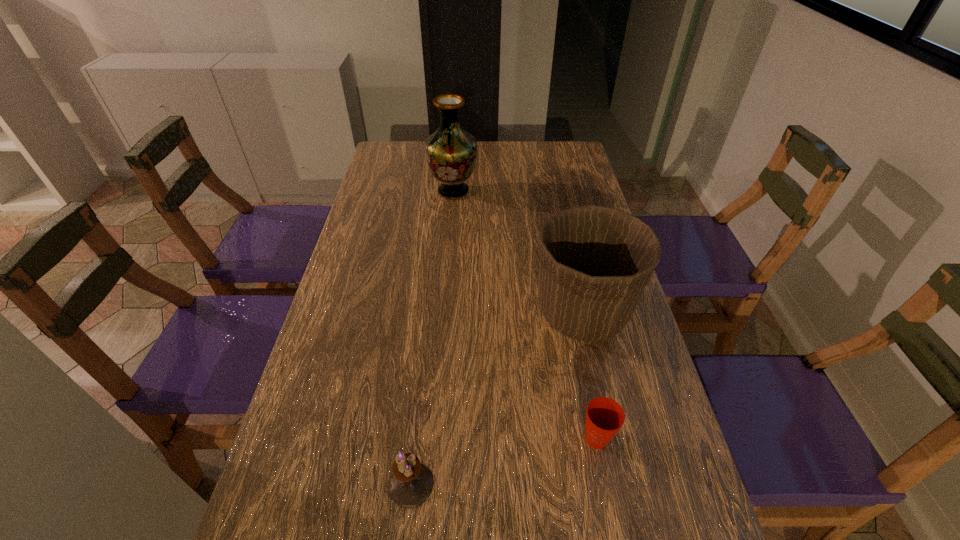
This screenshot has height=540, width=960. I want to click on vase, so click(451, 152).

In order to click on the tallest object in this screenshot , I will do `click(451, 152)`.

You are a GUI agent. You are given a task and a screenshot of the screen. Output one action in this format:
    pyautogui.click(x=<x>, y=<y>)
    Task: Click on the flowerpot
    The width and height of the screenshot is (960, 540).
    Given the screenshot: What is the action you would take?
    pyautogui.click(x=594, y=262)

The image size is (960, 540). Find the location of `the second farthest object`. the second farthest object is located at coordinates (594, 262).

Locate an element on the screen. the second shortest object is located at coordinates (411, 483).

The image size is (960, 540). I want to click on candle holder, so click(411, 483).

Locate an element on the screen. cup is located at coordinates (604, 417).

Find the location of a particular element. This screenshot has width=960, height=540. the shortest object is located at coordinates (604, 417).

Identify the location of vacant space located 0.280m on the right of the farthest object. (557, 191).

At what (x,y) coordinates should I click in order to perform the action: click on vacant region located 0.090m on the back of the second tallest object. Please return your answer as a coordinate pair (x, y). The height and width of the screenshot is (540, 960). Looking at the image, I should click on (570, 258).